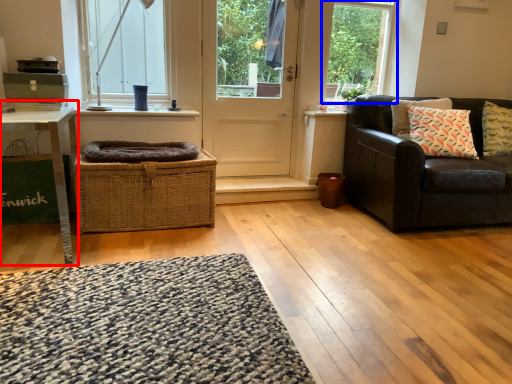
Question: Which of the following is the closest to the observer, table (highlighted by a red box) or window frame (highlighted by a blue box)?

Choices:
 (A) table
 (B) window frame

Answer: (A)